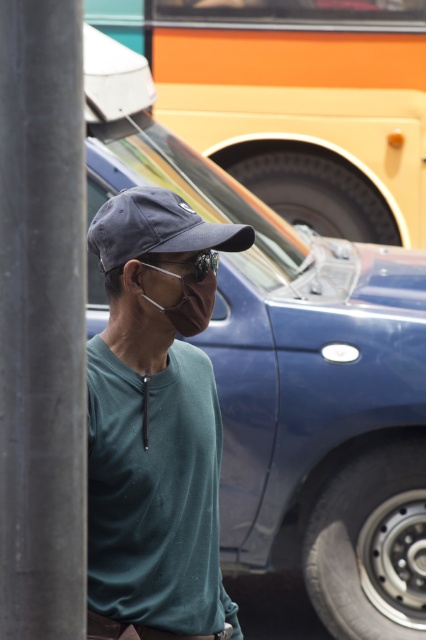
Question: Which of the following is the farthest from the observer?

Choices:
 (A) (75, 508)
 (B) (157, 268)
 (C) (149, 323)
 (D) (184, 205)

Answer: (D)

Question: Which is farther from the dark blue fabric baseball cap at center?

Choices:
 (A) smooth gray pole at left
 (B) clear plastic goggles at center

Answer: (A)

Question: Is matte green shirt at center positioned before smooth gray pole at left?

Choices:
 (A) yes
 (B) no

Answer: (B)

Question: Is matte green shirt at center below dark blue fabric baseball cap at center?

Choices:
 (A) yes
 (B) no

Answer: (A)

Question: Can you confirm if dark blue fabric baseball cap at center is thinner than clear plastic goggles at center?

Choices:
 (A) no
 (B) yes

Answer: (A)

Question: Which object is positioned farthest from the dark blue fabric baseball cap at center?

Choices:
 (A) smooth gray pole at left
 (B) matte green shirt at center

Answer: (A)